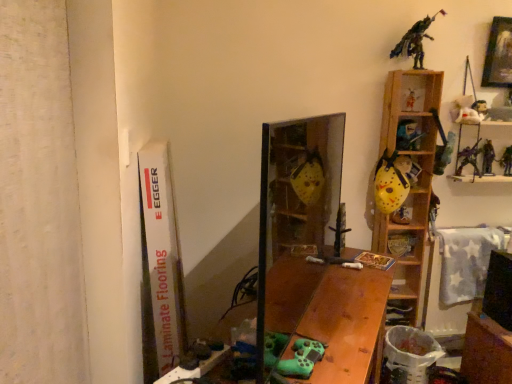
Question: From the image's perspective, does yellow matte hockey mask at upper right, the sixth toy viewed from the left, appear lower than yellow matte hockey mask at right, which is the third toy from left to right?

Choices:
 (A) no
 (B) yes

Answer: (B)

Question: From a real-world perspective, is yellow matte hockey mask at upper right, the sixth toy viewed from the left, physically above yellow matte hockey mask at right, placed as the 10th toy when sorted from right to left?

Choices:
 (A) yes
 (B) no

Answer: (B)

Question: Does yellow matte hockey mask at upper right, which is the seventh toy in right-to-left order, have a greater height compared to yellow matte hockey mask at right, placed as the 10th toy when sorted from right to left?

Choices:
 (A) yes
 (B) no

Answer: (B)

Question: Considering the relative sizes of yellow matte hockey mask at upper right, the sixth toy viewed from the left, and yellow matte hockey mask at right, placed as the 10th toy when sorted from right to left, in the image provided, is yellow matte hockey mask at upper right, the sixth toy viewed from the left, bigger than yellow matte hockey mask at right, placed as the 10th toy when sorted from right to left,?

Choices:
 (A) yes
 (B) no

Answer: (B)

Question: Considering the relative sizes of yellow matte hockey mask at upper right, which is the seventh toy in right-to-left order, and yellow matte hockey mask at right, placed as the 10th toy when sorted from right to left, in the image provided, is yellow matte hockey mask at upper right, which is the seventh toy in right-to-left order, wider than yellow matte hockey mask at right, placed as the 10th toy when sorted from right to left,?

Choices:
 (A) no
 (B) yes

Answer: (A)

Question: Is metallic silver figure at upper right, the fifth toy when ordered from left to right, spatially inside metallic blue toy at upper right, marked as the 6th toy in a right-to-left arrangement, or outside of it?

Choices:
 (A) inside
 (B) outside

Answer: (B)

Question: From a real-world perspective, relative to metallic blue toy at upper right, marked as the 6th toy in a right-to-left arrangement, is metallic silver figure at upper right, the fifth toy when ordered from left to right, vertically above or below?

Choices:
 (A) below
 (B) above

Answer: (B)

Question: From their relative heights in the image, would you say metallic silver figure at upper right, the 8th toy when ordered from right to left, is taller or shorter than metallic blue toy at upper right, marked as the 6th toy in a right-to-left arrangement?

Choices:
 (A) short
 (B) tall

Answer: (A)

Question: Considering the positions of point (414, 89) and point (416, 132), is point (414, 89) closer or farther from the camera than point (416, 132)?

Choices:
 (A) farther
 (B) closer

Answer: (B)

Question: In the image, is metallic blue toy at upper right, marked as the 6th toy in a right-to-left arrangement, on the left side or the right side of wooden table at lower right, arranged as the second table when viewed from the left?

Choices:
 (A) right
 (B) left

Answer: (B)

Question: From the image's perspective, is metallic blue toy at upper right, which is the 7th toy in left-to-right order, positioned above or below wooden table at lower right, arranged as the second table when viewed from the left?

Choices:
 (A) below
 (B) above

Answer: (B)

Question: Considering the positions of metallic blue toy at upper right, marked as the 6th toy in a right-to-left arrangement, and wooden table at lower right, the first table positioned from the right, in the image, is metallic blue toy at upper right, marked as the 6th toy in a right-to-left arrangement, bigger or smaller than wooden table at lower right, the first table positioned from the right,?

Choices:
 (A) big
 (B) small

Answer: (B)

Question: Is point (399, 145) closer or farther from the camera than point (502, 332)?

Choices:
 (A) closer
 (B) farther

Answer: (B)

Question: In terms of height, does wooden table at lower right, arranged as the second table when viewed from the left, look taller or shorter compared to wooden picture frame at upper right?

Choices:
 (A) tall
 (B) short

Answer: (A)

Question: In the image, is wooden table at lower right, arranged as the second table when viewed from the left, positioned in front of or behind wooden picture frame at upper right?

Choices:
 (A) behind
 (B) front

Answer: (B)